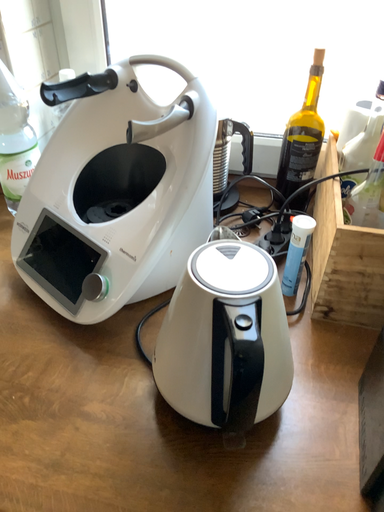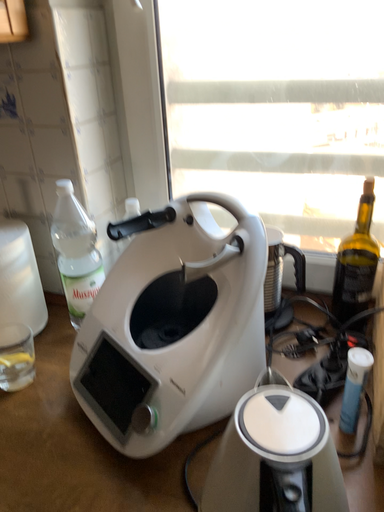
Question: How did the camera likely rotate when shooting the video?

Choices:
 (A) rotated left
 (B) rotated right

Answer: (A)